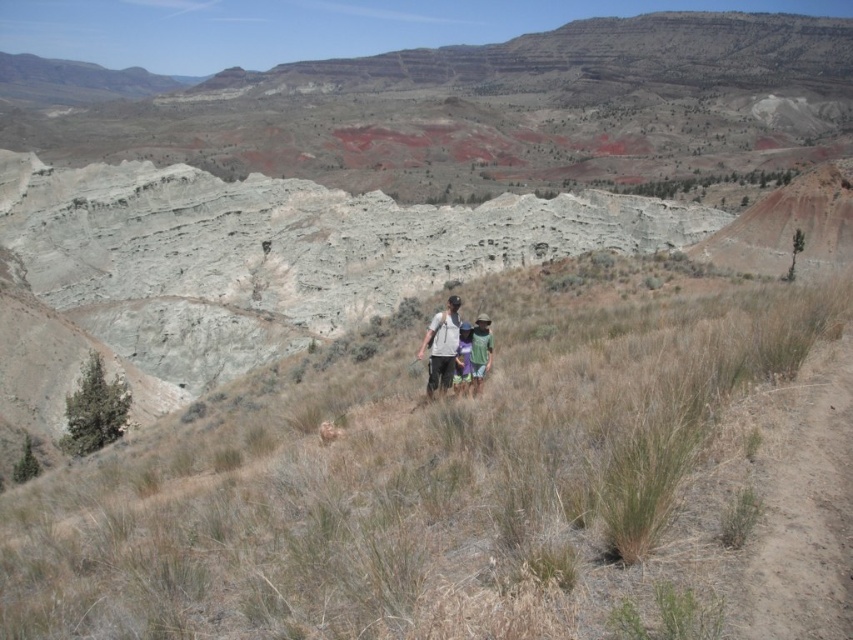
Who is positioned more to the right, dry grass at center or light gray fabric shirt at center?

From the viewer's perspective, light gray fabric shirt at center appears more on the right side.

Where is `dry grass at center`? The height and width of the screenshot is (640, 853). dry grass at center is located at coordinates (476, 484).

What do you see at coordinates (476, 484) in the screenshot? The height and width of the screenshot is (640, 853). I see `dry grass at center` at bounding box center [476, 484].

The width and height of the screenshot is (853, 640). Identify the location of dry grass at center. (476, 484).

Between point (436, 337) and point (485, 342), which one is positioned behind?

The point (436, 337) is behind.

The image size is (853, 640). What do you see at coordinates (440, 346) in the screenshot?
I see `light gray fabric shirt at center` at bounding box center [440, 346].

The image size is (853, 640). Find the location of `light gray fabric shirt at center`. light gray fabric shirt at center is located at coordinates (440, 346).

The height and width of the screenshot is (640, 853). Find the location of `light gray fabric shirt at center`. light gray fabric shirt at center is located at coordinates (440, 346).

What do you see at coordinates (476, 484) in the screenshot? Image resolution: width=853 pixels, height=640 pixels. I see `dry grass at center` at bounding box center [476, 484].

Does dry grass at center have a greater width compared to green fabric shirt at center?

Indeed, dry grass at center has a greater width compared to green fabric shirt at center.

Is point (846, 522) behind point (476, 339)?

That is False.

I want to click on dry grass at center, so click(476, 484).